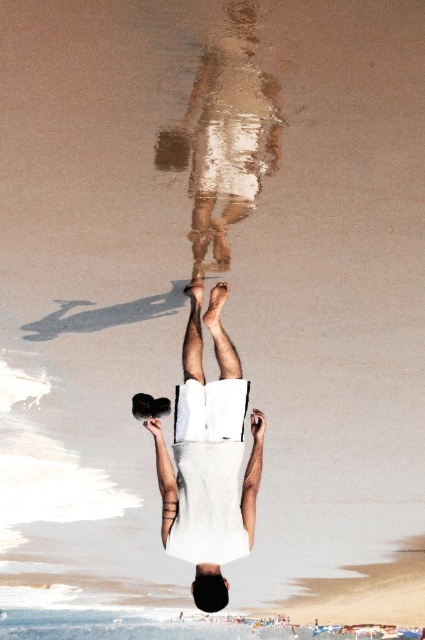
Does smooth white skin at center have a smaller size compared to shiny metallic legs at center?

No, smooth white skin at center is not smaller than shiny metallic legs at center.

Measure the distance between point [221,520] and camera.

Point [221,520] and camera are 4.64 meters apart.

Does point (189, 465) come farther from viewer compared to point (204, 122)?

Yes, it is.

What are the coordinates of `smooth white skin at center` in the screenshot? It's located at (209, 458).